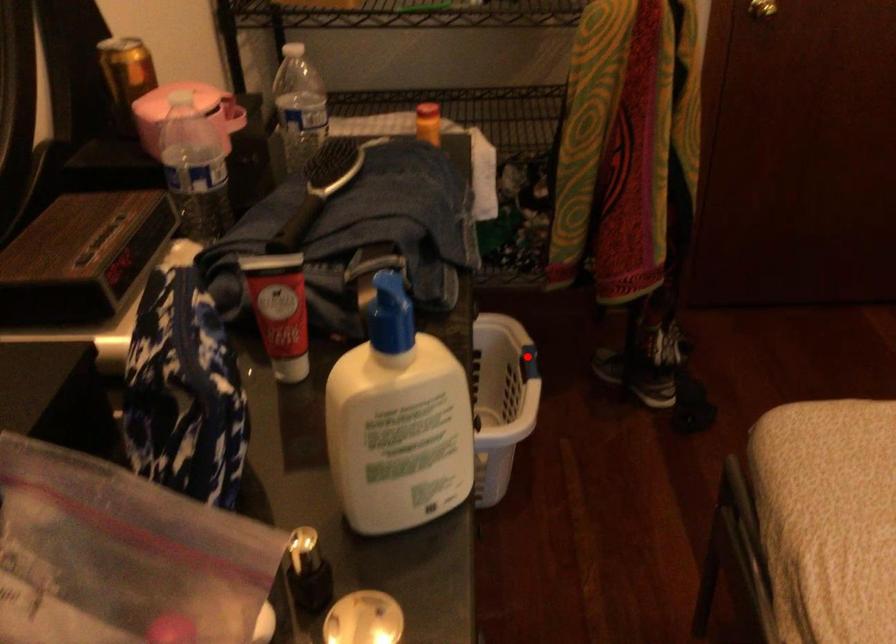
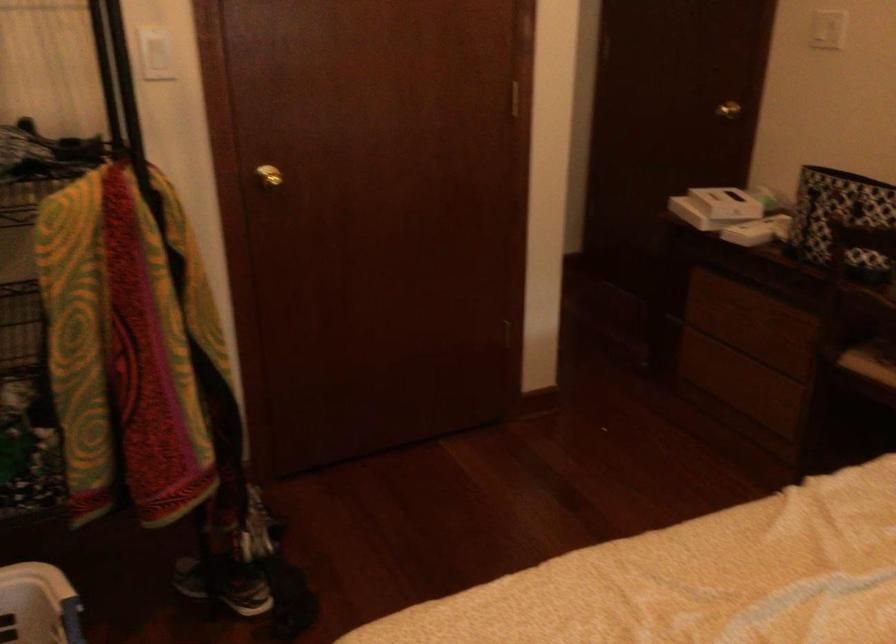
The point at the highlighted location is marked in the first image. Where is the corresponding point in the second image?

(63, 616)